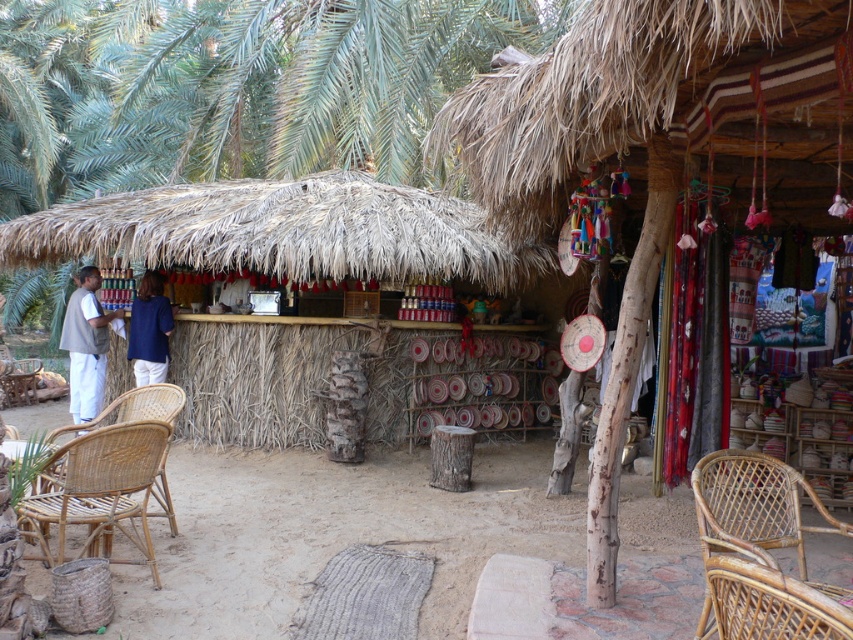
Does thatched straw hut at center have a greater height compared to natural wicker chair at lower left?

Yes, thatched straw hut at center is taller than natural wicker chair at lower left.

Can you confirm if thatched straw hut at center is positioned to the right of natural wicker chair at lower left?

Indeed, thatched straw hut at center is positioned on the right side of natural wicker chair at lower left.

Is point (219, 424) positioned in front of point (155, 412)?

No, it is behind (155, 412).

Find the location of a particular element. Image resolution: width=853 pixels, height=640 pixels. thatched straw hut at center is located at coordinates (279, 232).

Can you confirm if rattan chair at lower right is smaller than natural wicker chair at lower left?

Yes, rattan chair at lower right is smaller than natural wicker chair at lower left.

Is rattan chair at lower right closer to camera compared to natural wicker chair at lower left?

Yes, rattan chair at lower right is closer to the viewer.

Who is more distant from viewer, (744, 545) or (173, 518)?

The point (173, 518) is behind.

Identify the location of rattan chair at lower right. (756, 509).

The width and height of the screenshot is (853, 640). What do you see at coordinates (279, 232) in the screenshot?
I see `thatched straw hut at center` at bounding box center [279, 232].

Is thatched straw hut at center below rattan chair at lower right?

No.

Find the location of `thatched straw hut at center`. thatched straw hut at center is located at coordinates [x=279, y=232].